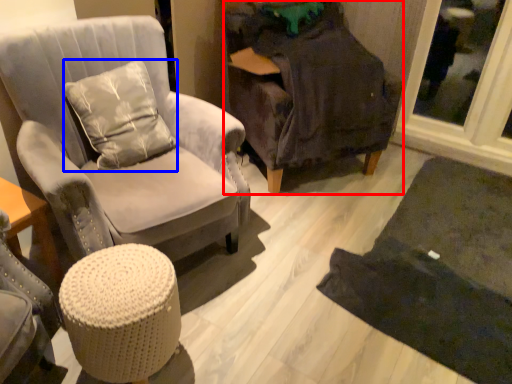
Question: Which object appears closest to the camera in this image, chair (highlighted by a red box) or pillow (highlighted by a blue box)?

Choices:
 (A) chair
 (B) pillow

Answer: (B)